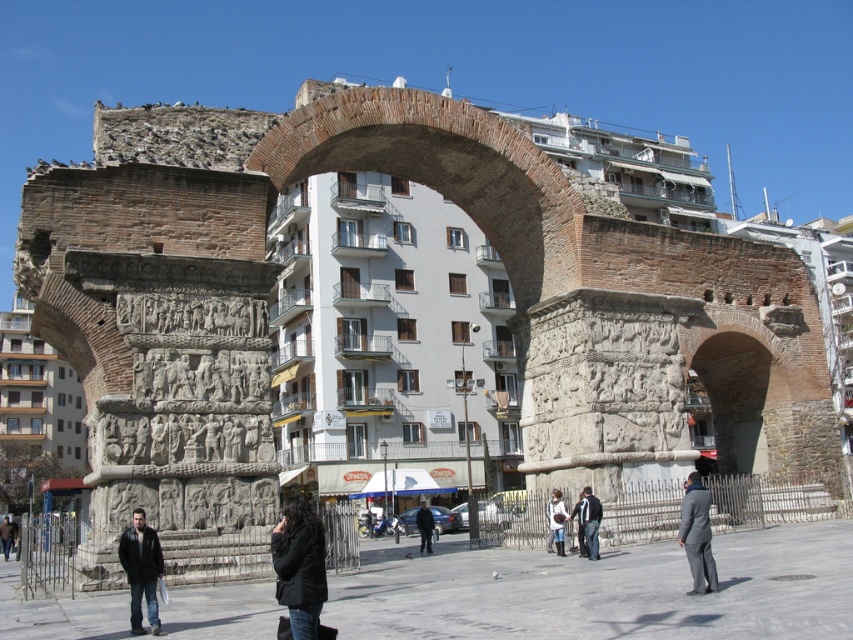
You are a tour guide explaining the historical archway to visitors. You notice two dark gray jackets in the crowd. One is labeled as the dark gray jacket at center and the other as the dark gray jacket at lower center. Which of these jackets is positioned higher in the image?

The dark gray jacket at center is positioned higher than the dark gray jacket at lower center, as it is described as much taller.

You are standing at the base of the large stone archway and want to take a photo of the modern multi story building in the background. The camera you are using has a focal length of 50mm and a sensor size of 24x36mm. To ensure the entire building fits in the frame, you need to calculate the minimum distance you should be from the point at (309, 554). What is the minimum distance in feet you should maintain?

The point at (309, 554) is 82.12 feet from the camera. To ensure the entire building fits in the frame with a 50mm lens and 24x36mm sensor, the minimum distance required is 82.12 feet.

You are standing in front of the historical archway and looking at the modern building behind it. There is a black leather jacket at lower center. Where is the point at coordinates (299, 566) located?

The point at coordinates (299, 566) is located on the black leather jacket at lower center.